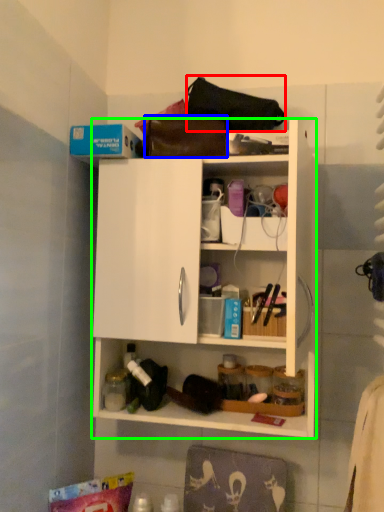
Question: Based on their relative distances, which object is nearer to handbag (highlighted by a red box)? Choose from handbag (highlighted by a blue box) and cabinetry (highlighted by a green box).

Choices:
 (A) handbag
 (B) cabinetry

Answer: (A)